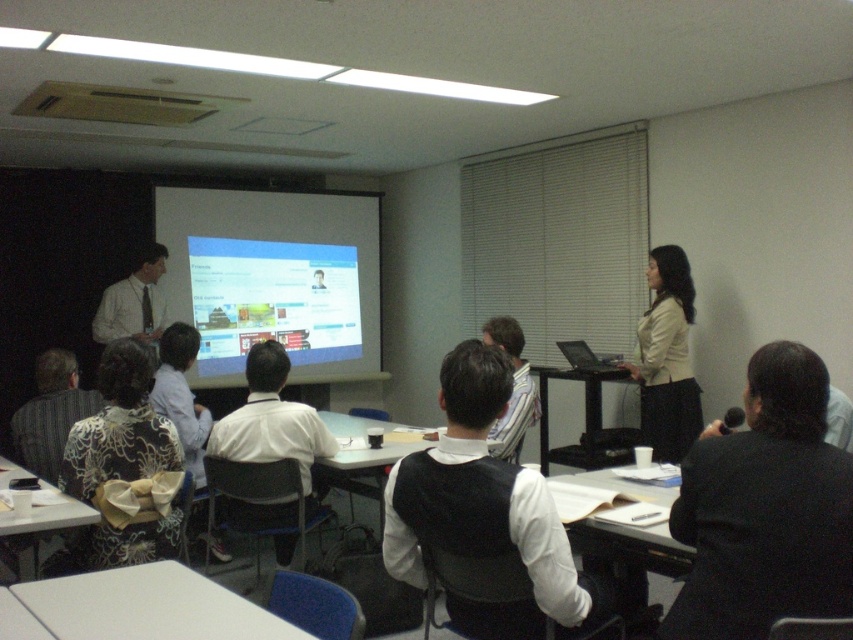
Can you confirm if white matte table at lower left is taller than beige fabric jacket at center?

No, white matte table at lower left is not taller than beige fabric jacket at center.

Between point (206, 621) and point (686, 275), which one is positioned in front?

Point (206, 621) is more forward.

Between point (109, 598) and point (672, 262), which one is positioned behind?

Positioned behind is point (672, 262).

Where is `white matte table at lower left`? This screenshot has height=640, width=853. white matte table at lower left is located at coordinates (149, 605).

Is matte white shirt at center bigger than white plastic table at center?

No, matte white shirt at center is not bigger than white plastic table at center.

Locate an element on the screen. Image resolution: width=853 pixels, height=640 pixels. matte white shirt at center is located at coordinates (134, 301).

Is point (143, 301) closer to viewer compared to point (357, 432)?

That is False.

The width and height of the screenshot is (853, 640). I want to click on matte white shirt at center, so click(x=134, y=301).

Between white glossy table at lower center and black plastic table at center, which one appears on the left side from the viewer's perspective?

Positioned to the left is white glossy table at lower center.

Locate an element on the screen. white glossy table at lower center is located at coordinates (630, 554).